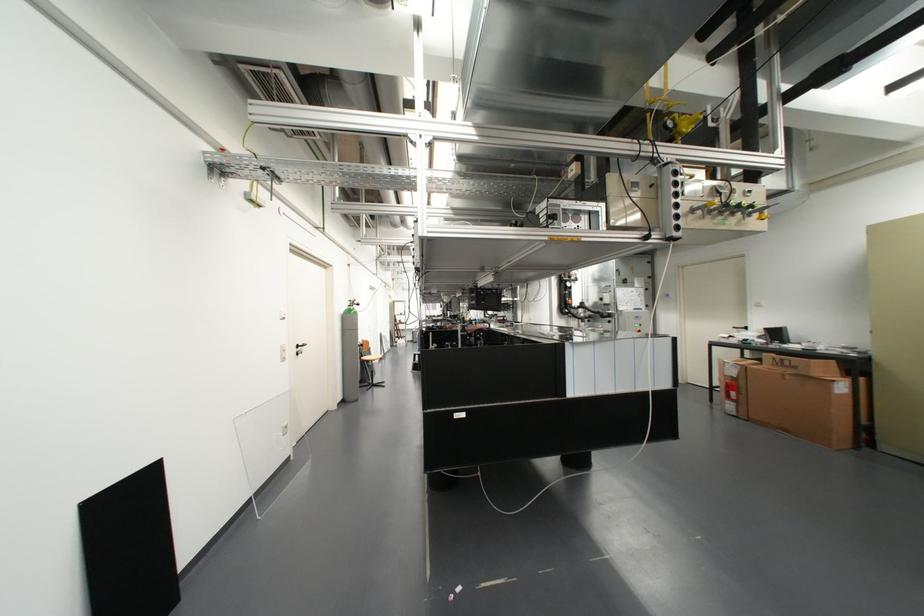
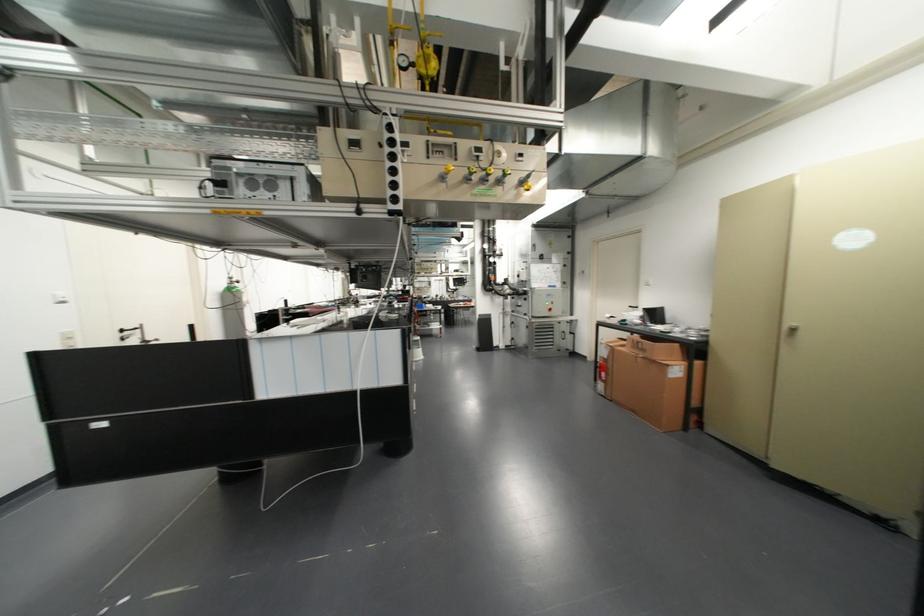
Find the pixel in the second image that matches (733,392) in the first image.

(602, 374)